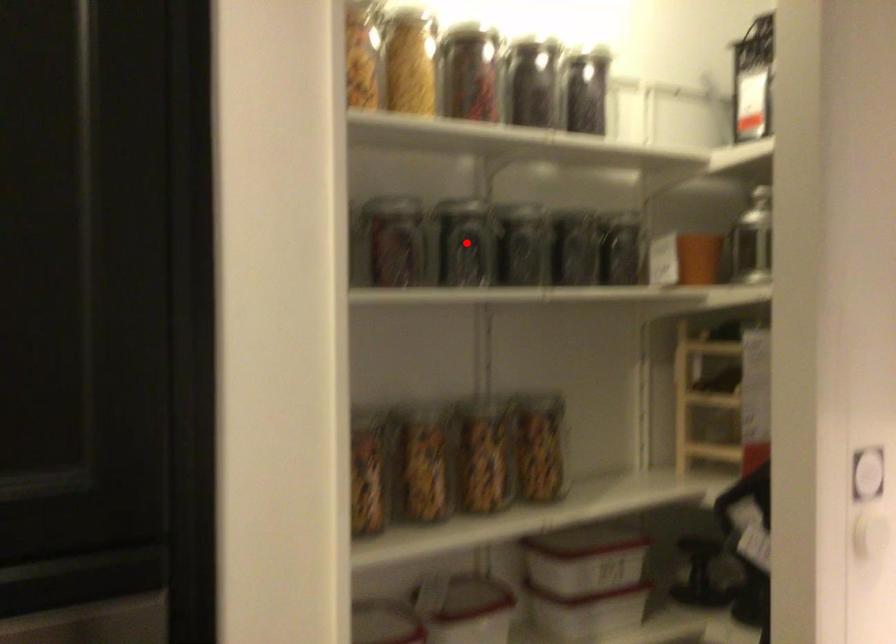
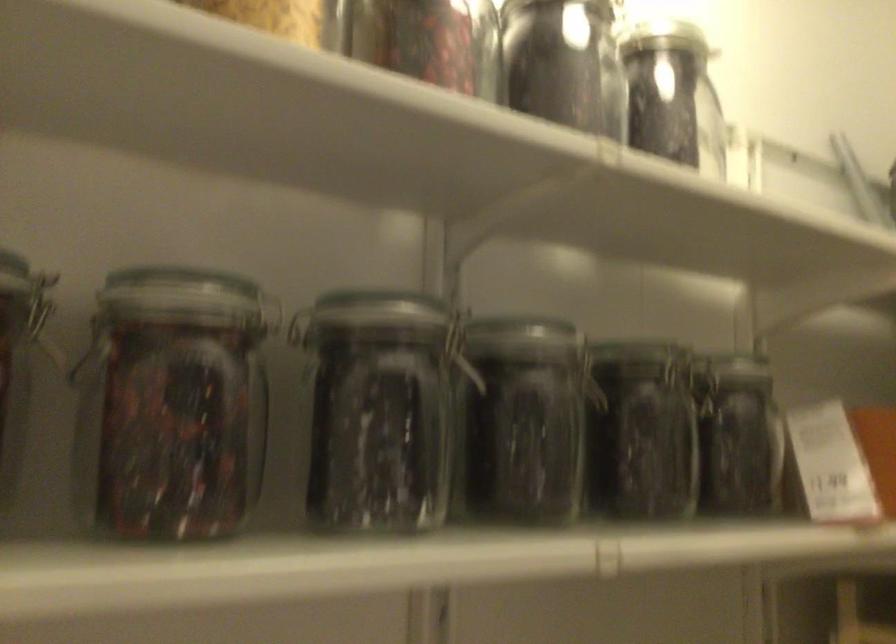
Question: I am providing you with two images of the same scene from different viewpoints. Given a red point in image1, look at the same physical point in image2. Is it:

Choices:
 (A) Closer to the viewpoint
 (B) Farther from the viewpoint

Answer: (A)